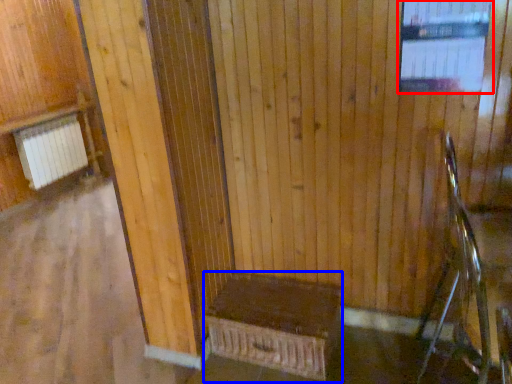
Question: Which point is further to the camera, window (highlighted by a red box) or furniture (highlighted by a blue box)?

Choices:
 (A) window
 (B) furniture

Answer: (B)